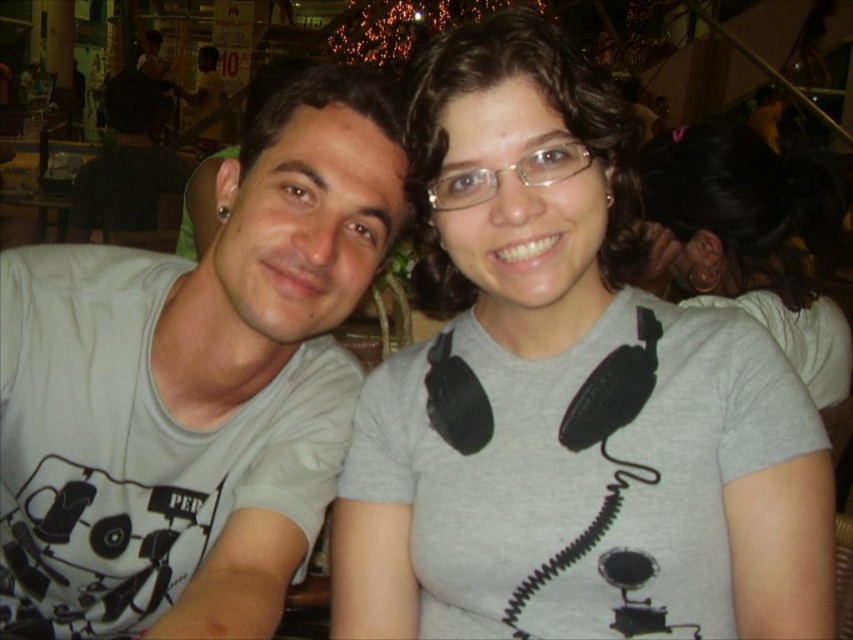
You are taking a photo of two friends sitting at a table in a cafe. You want to focus on the point closer to the camera. Which point should you focus on between point (172, 444) and point (76, 234)?

Point (172, 444) is closer to the camera than point (76, 234), so you should focus on point (172, 444).